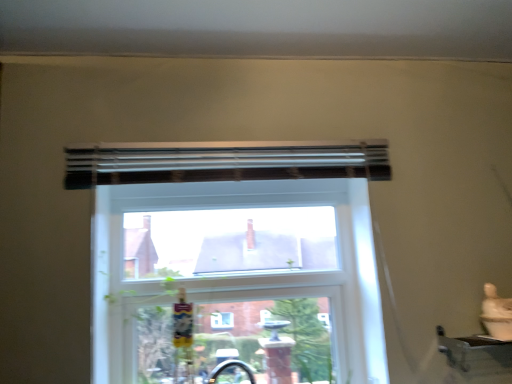
Question: From a real-world perspective, is clear glass window at center above or below black matte curtain at upper center?

Choices:
 (A) above
 (B) below

Answer: (B)

Question: Is point (164, 203) closer or farther from the camera than point (102, 165)?

Choices:
 (A) closer
 (B) farther

Answer: (B)

Question: Which of these objects is positioned closest to the black matte curtain at upper center?

Choices:
 (A) clear glass window at center
 (B) metallic silver window sill at lower right

Answer: (A)

Question: Estimate the real-world distances between objects in this image. Which object is farther from the clear glass window at center?

Choices:
 (A) metallic silver window sill at lower right
 (B) black matte curtain at upper center

Answer: (A)